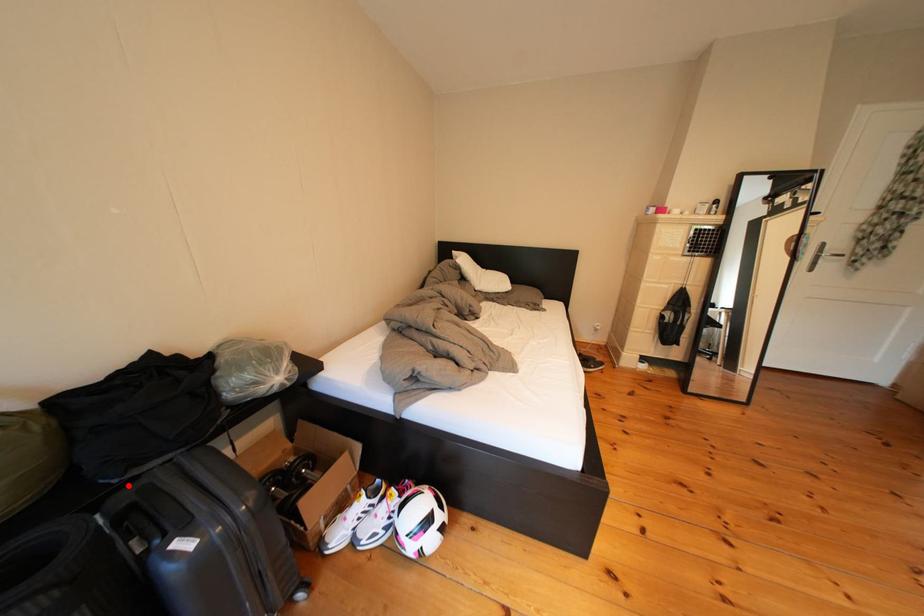
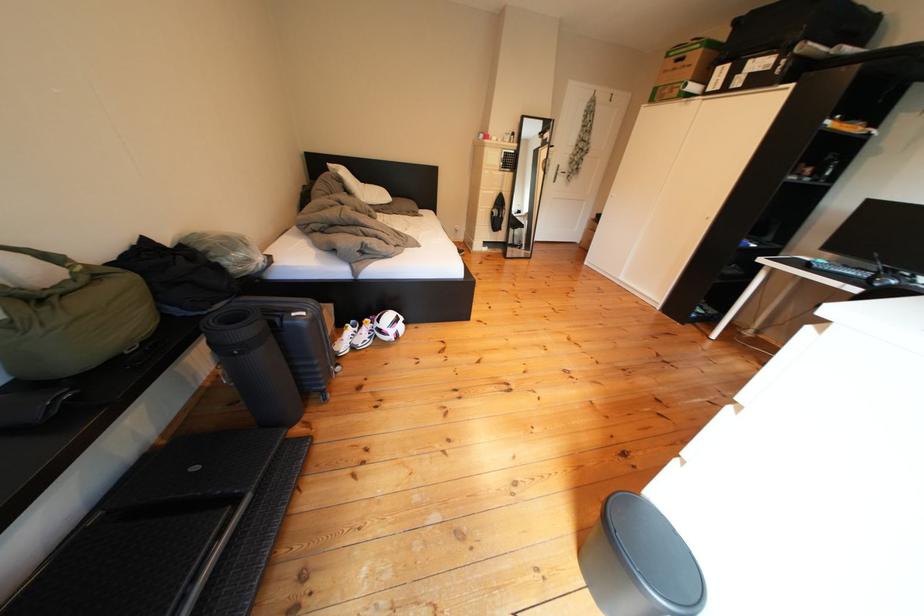
Question: I am providing you with two images of the same scene from different viewpoints. In image1, a red point is highlighted. Considering the same 3D point in image2, which of the following is correct?

Choices:
 (A) It is closer
 (B) It is farther

Answer: (B)